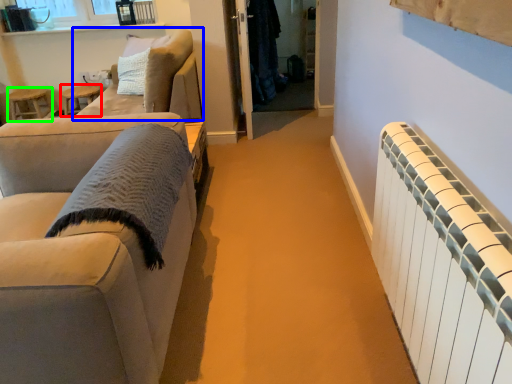
Question: Which object is positioned farthest from side table (highlighted by a red box)? Select from studio couch (highlighted by a blue box) and stool (highlighted by a green box).

Choices:
 (A) studio couch
 (B) stool

Answer: (A)